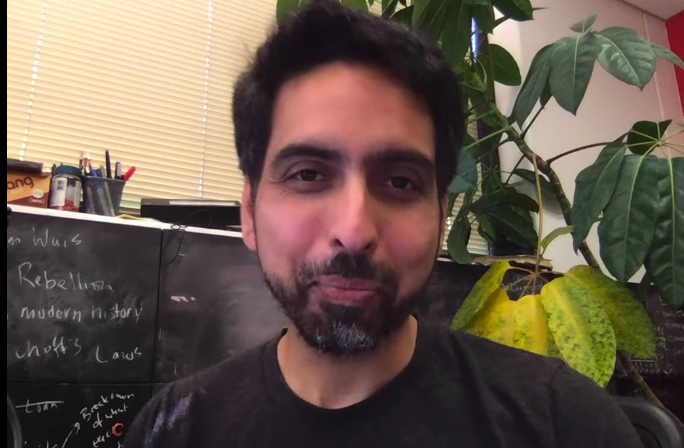
Locate an element on the screen. chalk board is located at coordinates (237, 325), (146, 268).